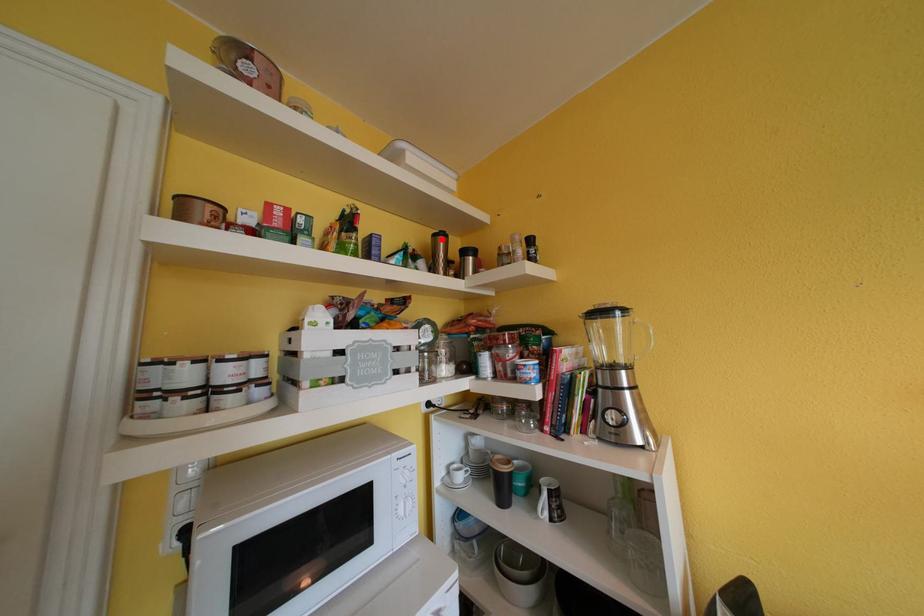
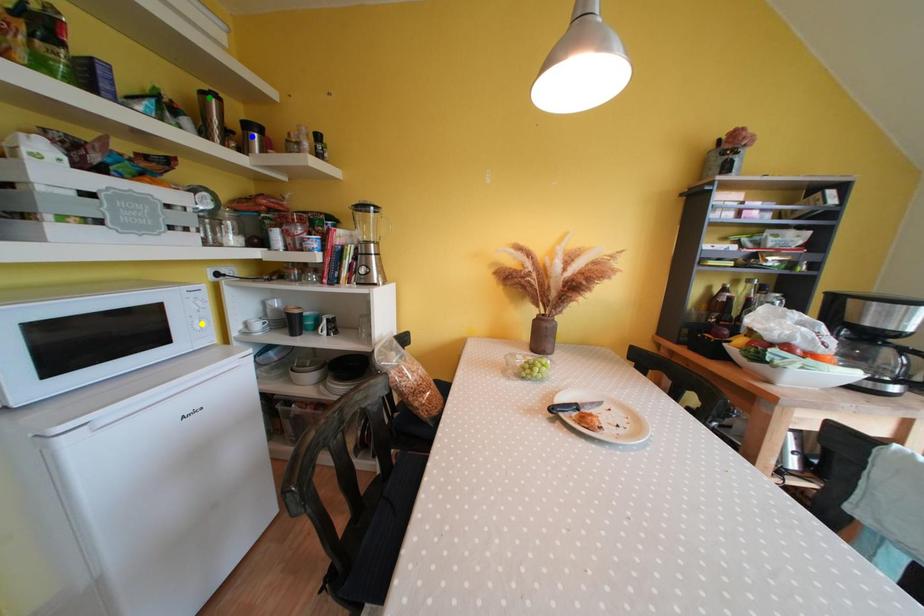
Question: I am providing you with two images of the same scene from different viewpoints. A red point is marked on the first image. You are given multiple points on the second image. Which spot in image 2 lines up with the point in image 1?

Choices:
 (A) yellow point
 (B) green point
 (C) blue point

Answer: (B)